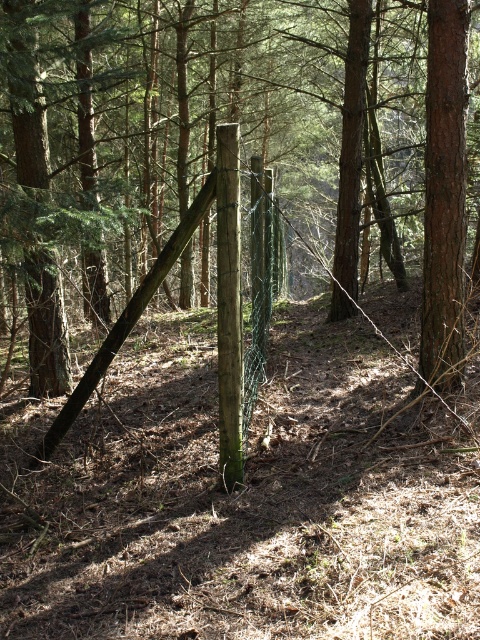
You are a hiker navigating through the forest and come across the fence described. You notice two points on the fence marked as point (454,380) and point (228,157). Which point would be closer to you if you are facing the fence directly?

Point (228,157) is closer to you because it is in front of point (454,380) when facing the fence directly.